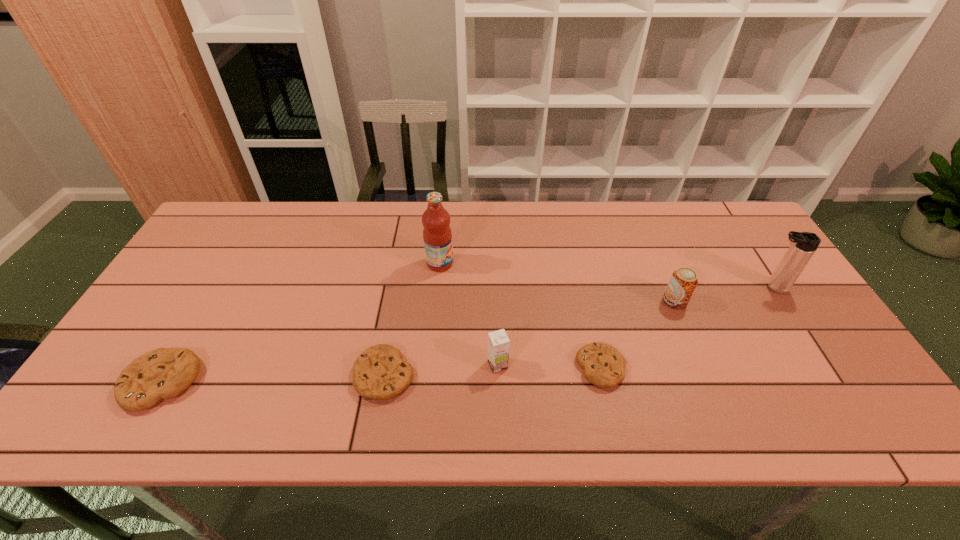
Locate an element on the screen. the leftmost cookie is located at coordinates (164, 373).

Locate an element on the screen. The height and width of the screenshot is (540, 960). the second shortest cookie is located at coordinates tap(379, 373).

In order to click on the second cookie from left to right in this screenshot , I will do `click(379, 373)`.

This screenshot has width=960, height=540. In order to click on the shortest cookie in this screenshot , I will do pyautogui.click(x=603, y=365).

This screenshot has width=960, height=540. Find the location of `the rightmost cookie`. the rightmost cookie is located at coordinates (603, 365).

Identify the location of the second tallest object. (803, 244).

Identify the location of the rightmost object. (803, 244).

You are a GUI agent. You are given a task and a screenshot of the screen. Output one action in this format:
    pyautogui.click(x=<x>, y=<y>)
    Task: Click on the beer can
    
    Given the screenshot: What is the action you would take?
    pyautogui.click(x=683, y=281)

At what (x,y) coordinates should I click in order to perform the action: click on fruit juice. Please return your answer as a coordinate pair (x, y). Looking at the image, I should click on (437, 235).

You are a GUI agent. You are given a task and a screenshot of the screen. Output one action in this format:
    pyautogui.click(x=<x>, y=<y>)
    Task: Click on the farthest object
    The width and height of the screenshot is (960, 540).
    Given the screenshot: What is the action you would take?
    pyautogui.click(x=437, y=235)